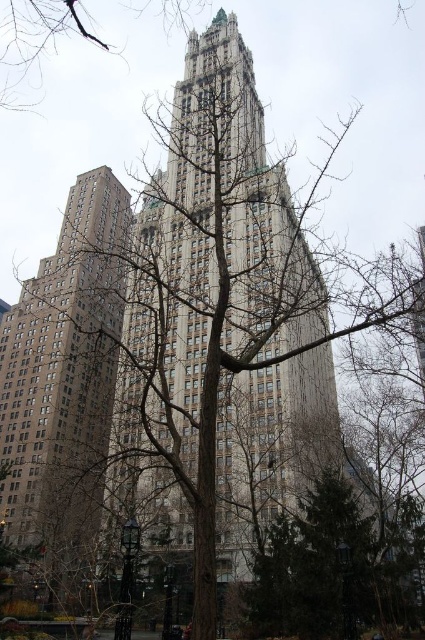
Is the position of gray stone tower at center less distant than that of bare branches at upper center?

Yes, it is.

Can you confirm if gray stone tower at center is positioned below bare branches at upper center?

Yes.

Is point (246, 93) positioned before point (53, 40)?

Yes, it is.

The width and height of the screenshot is (425, 640). I want to click on gray stone tower at center, so click(223, 225).

Does beige stone building at left have a greater width compared to bare branches at upper center?

Incorrect, beige stone building at left's width does not surpass bare branches at upper center's.

Does beige stone building at left appear on the left side of bare branches at upper center?

In fact, beige stone building at left is to the right of bare branches at upper center.

This screenshot has height=640, width=425. Describe the element at coordinates (64, 376) in the screenshot. I see `beige stone building at left` at that location.

Where is `beige stone building at left`? Image resolution: width=425 pixels, height=640 pixels. beige stone building at left is located at coordinates (64, 376).

Does gray stone tower at center have a lesser height compared to beige stone building at left?

In fact, gray stone tower at center may be taller than beige stone building at left.

Who is more distant from viewer, (243, 212) or (104, 387)?

The point (104, 387) is behind.

At what (x,y) coordinates should I click in order to perform the action: click on gray stone tower at center. Please return your answer as a coordinate pair (x, y). This screenshot has height=640, width=425. Looking at the image, I should click on (223, 225).